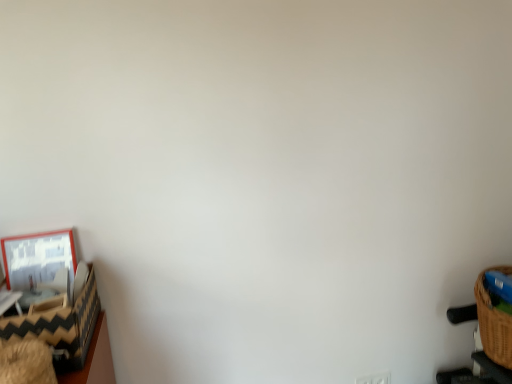
Question: Is black and white zigzag-patterned basket at left directly adjacent to white plastic electric outlet at lower right?

Choices:
 (A) no
 (B) yes

Answer: (A)

Question: Does black and white zigzag-patterned basket at left turn towards white plastic electric outlet at lower right?

Choices:
 (A) no
 (B) yes

Answer: (A)

Question: Is black and white zigzag-patterned basket at left smaller than white plastic electric outlet at lower right?

Choices:
 (A) yes
 (B) no

Answer: (B)

Question: Is black and white zigzag-patterned basket at left bigger than white plastic electric outlet at lower right?

Choices:
 (A) yes
 (B) no

Answer: (A)

Question: From a real-world perspective, is black and white zigzag-patterned basket at left located beneath white plastic electric outlet at lower right?

Choices:
 (A) yes
 (B) no

Answer: (B)

Question: From the image's perspective, would you say black and white zigzag-patterned basket at left is shown under white plastic electric outlet at lower right?

Choices:
 (A) no
 (B) yes

Answer: (A)

Question: Considering the relative sizes of black and white zigzag-patterned basket at left and matte wooden picture frame at left in the image provided, is black and white zigzag-patterned basket at left wider than matte wooden picture frame at left?

Choices:
 (A) no
 (B) yes

Answer: (B)

Question: Is black and white zigzag-patterned basket at left outside of matte wooden picture frame at left?

Choices:
 (A) yes
 (B) no

Answer: (A)

Question: Is matte wooden picture frame at left a part of black and white zigzag-patterned basket at left?

Choices:
 (A) yes
 (B) no

Answer: (A)

Question: Does black and white zigzag-patterned basket at left appear on the left side of matte wooden picture frame at left?

Choices:
 (A) yes
 (B) no

Answer: (B)

Question: Is black and white zigzag-patterned basket at left closer to the viewer compared to matte wooden picture frame at left?

Choices:
 (A) yes
 (B) no

Answer: (A)

Question: Are black and white zigzag-patterned basket at left and matte wooden picture frame at left beside each other?

Choices:
 (A) yes
 (B) no

Answer: (B)

Question: Is matte wooden picture frame at left facing away from black and white zigzag-patterned basket at left?

Choices:
 (A) no
 (B) yes

Answer: (A)